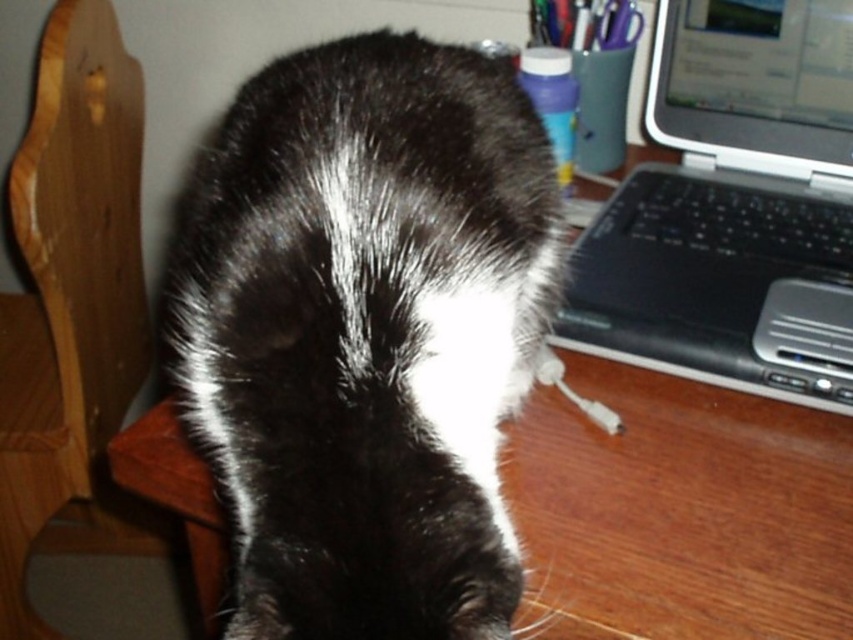
Question: Among these objects, which one is farthest from the camera?

Choices:
 (A) black fur cat at center
 (B) wooden chair at left

Answer: (B)

Question: Is black fur cat at center thinner than black plastic laptop at right?

Choices:
 (A) no
 (B) yes

Answer: (B)

Question: Which of the following is the closest to the observer?

Choices:
 (A) (376, 166)
 (B) (805, 150)
 (C) (57, 333)

Answer: (A)

Question: Is black fur cat at center smaller than black plastic laptop at right?

Choices:
 (A) no
 (B) yes

Answer: (B)

Question: Which of the following is the closest to the observer?

Choices:
 (A) (424, 152)
 (B) (105, 541)

Answer: (A)

Question: Does black plastic laptop at right appear over wooden chair at left?

Choices:
 (A) yes
 (B) no

Answer: (A)